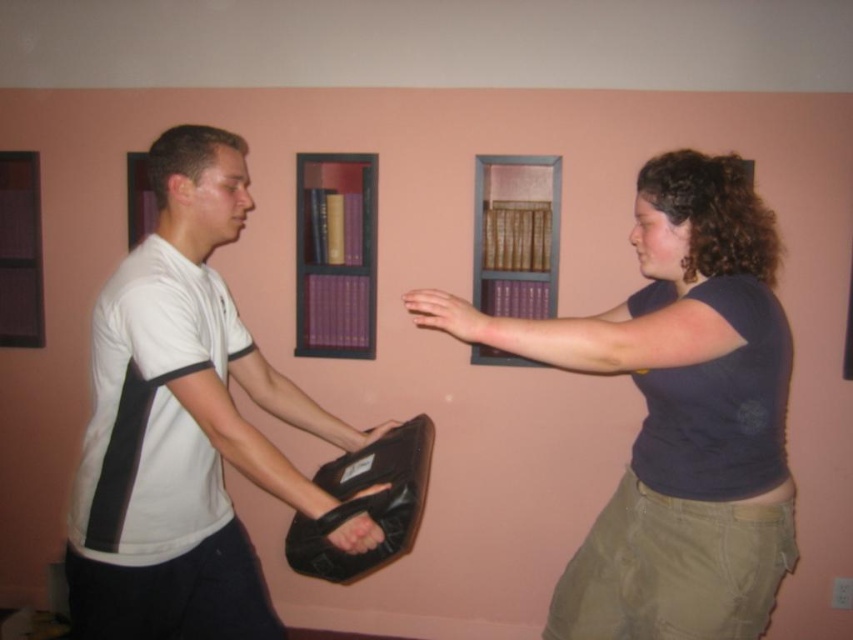
Question: Estimate the real-world distances between objects in this image. Which object is closer to the white matte shirt at center?

Choices:
 (A) purple matte bookshelf at upper center
 (B) smooth skin hand at center
 (C) matte black bag at center

Answer: (C)

Question: Is leather at center to the left of matte black bag at center from the viewer's perspective?

Choices:
 (A) yes
 (B) no

Answer: (B)

Question: Which point is farther to the camera?

Choices:
 (A) (544, 192)
 (B) (367, 548)
 (C) (364, 205)
 (D) (167, 497)

Answer: (A)

Question: Is smooth skin hand at center above matte black bag at center?

Choices:
 (A) no
 (B) yes

Answer: (B)

Question: Is purple matte bookshelf at center bigger than purple matte bookshelf at upper center?

Choices:
 (A) no
 (B) yes

Answer: (A)

Question: Which point is closer to the camera taking this photo?

Choices:
 (A) (483, 333)
 (B) (189, 342)
 (C) (370, 435)
 (D) (511, 188)

Answer: (A)